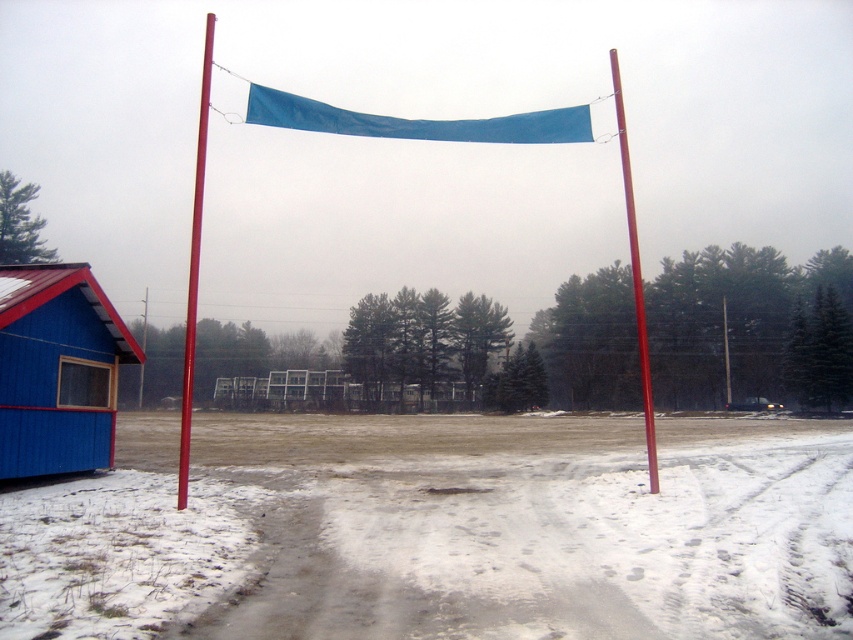
Based on the photo, does gray compacted dirt at center appear under blue fabric flag at center?

Yes, gray compacted dirt at center is below blue fabric flag at center.

Can you confirm if gray compacted dirt at center is taller than blue fabric flag at center?

No, gray compacted dirt at center is not taller than blue fabric flag at center.

Describe the element at coordinates (561, 547) in the screenshot. I see `gray compacted dirt at center` at that location.

Image resolution: width=853 pixels, height=640 pixels. What are the coordinates of `gray compacted dirt at center` in the screenshot? It's located at (561, 547).

Consider the image. Can you confirm if smooth red pole at left is wider than smooth red pole at right?

Indeed, smooth red pole at left has a greater width compared to smooth red pole at right.

Which of these two, smooth red pole at left or smooth red pole at right, stands taller?

smooth red pole at left is taller.

Describe the element at coordinates (194, 268) in the screenshot. This screenshot has height=640, width=853. I see `smooth red pole at left` at that location.

Where is `smooth red pole at left`? smooth red pole at left is located at coordinates (194, 268).

This screenshot has height=640, width=853. Identify the location of blue fabric flag at center. (416, 122).

Between blue fabric flag at center and smooth red pole at right, which one has less height?

Standing shorter between the two is blue fabric flag at center.

What do you see at coordinates (416, 122) in the screenshot? I see `blue fabric flag at center` at bounding box center [416, 122].

What are the coordinates of `blue fabric flag at center` in the screenshot? It's located at [416, 122].